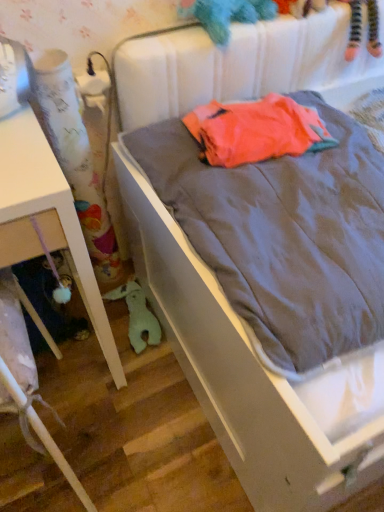
Question: Is neon orange fabric at center surrounded by fluffy teal stuffed animal at upper center, marked as the 1th toy in a right-to-left arrangement?

Choices:
 (A) no
 (B) yes

Answer: (A)

Question: Is neon orange fabric at center at the back of fluffy teal stuffed animal at upper center, which ranks as the 2th toy in back-to-front order?

Choices:
 (A) no
 (B) yes

Answer: (A)

Question: Could you tell me if fluffy teal stuffed animal at upper center, the 1th toy positioned from the top, is turned towards neon orange fabric at center?

Choices:
 (A) no
 (B) yes

Answer: (A)

Question: Considering the relative sizes of fluffy teal stuffed animal at upper center, marked as the 1th toy in a right-to-left arrangement, and neon orange fabric at center in the image provided, is fluffy teal stuffed animal at upper center, marked as the 1th toy in a right-to-left arrangement, shorter than neon orange fabric at center?

Choices:
 (A) no
 (B) yes

Answer: (A)

Question: From the image's perspective, is fluffy teal stuffed animal at upper center, which ranks as the 2th toy in back-to-front order, on neon orange fabric at center?

Choices:
 (A) yes
 (B) no

Answer: (A)

Question: From the image's perspective, is matte gray bed at center positioned above or below fluffy teal stuffed animal at upper center, the second toy when ordered from left to right?

Choices:
 (A) below
 (B) above

Answer: (A)

Question: In the image, is matte gray bed at center positioned in front of or behind fluffy teal stuffed animal at upper center, marked as the 1th toy in a right-to-left arrangement?

Choices:
 (A) behind
 (B) front

Answer: (B)

Question: Is point (132, 95) closer or farther from the camera than point (243, 9)?

Choices:
 (A) farther
 (B) closer

Answer: (A)

Question: Visually, is matte gray bed at center positioned to the left or to the right of fluffy teal stuffed animal at upper center, marked as the 1th toy in a right-to-left arrangement?

Choices:
 (A) right
 (B) left

Answer: (A)

Question: Is neon orange fabric at center in front of or behind white matte table at left in the image?

Choices:
 (A) front
 (B) behind

Answer: (B)

Question: From a real-world perspective, is neon orange fabric at center positioned above or below white matte table at left?

Choices:
 (A) above
 (B) below

Answer: (A)

Question: Considering the positions of neon orange fabric at center and white matte table at left in the image, is neon orange fabric at center taller or shorter than white matte table at left?

Choices:
 (A) tall
 (B) short

Answer: (B)

Question: Which is correct: neon orange fabric at center is inside white matte table at left, or outside of it?

Choices:
 (A) inside
 (B) outside

Answer: (B)

Question: Is matte gray bed at center taller or shorter than white fabric curtain at left?

Choices:
 (A) short
 (B) tall

Answer: (A)

Question: Is matte gray bed at center in front of or behind white fabric curtain at left in the image?

Choices:
 (A) front
 (B) behind

Answer: (A)